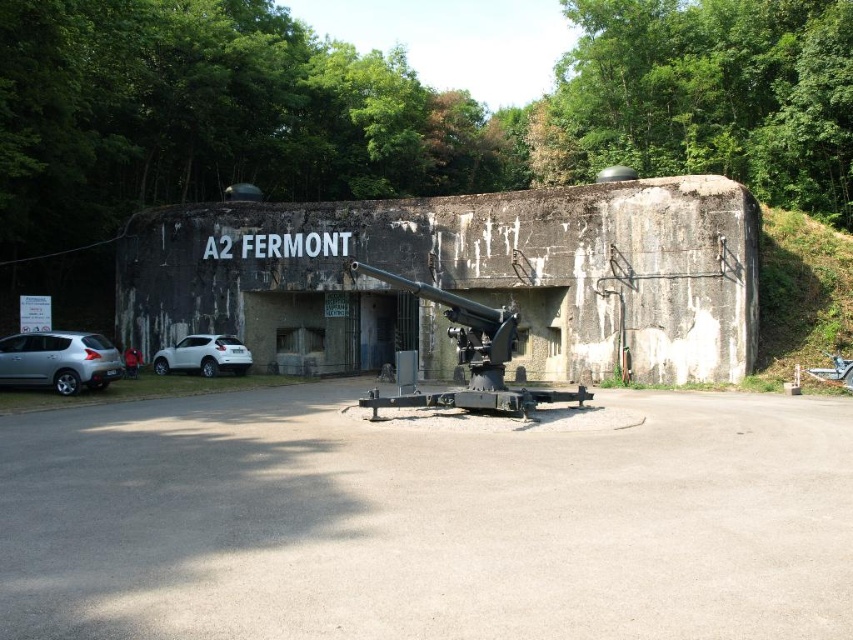
Between gray asphalt parking lot at center and satin silver car at lower left, which one is positioned lower?

gray asphalt parking lot at center is below.

Is the position of gray asphalt parking lot at center more distant than that of satin silver car at lower left?

That is False.

What do you see at coordinates (426, 522) in the screenshot?
I see `gray asphalt parking lot at center` at bounding box center [426, 522].

Locate an element on the screen. gray asphalt parking lot at center is located at coordinates (426, 522).

Does black matte cannon at center have a smaller size compared to white matte suv at lower left?

Incorrect, black matte cannon at center is not smaller in size than white matte suv at lower left.

Does black matte cannon at center have a lesser height compared to white matte suv at lower left?

No.

Who is more forward, [490,381] or [219,346]?

Point [490,381] is more forward.

Image resolution: width=853 pixels, height=640 pixels. What are the coordinates of `black matte cannon at center` in the screenshot? It's located at (469, 356).

Who is positioned more to the right, gray asphalt parking lot at center or black matte cannon at center?

black matte cannon at center is more to the right.

Between gray asphalt parking lot at center and black matte cannon at center, which one is positioned higher?

black matte cannon at center is higher up.

The width and height of the screenshot is (853, 640). What do you see at coordinates (426, 522) in the screenshot?
I see `gray asphalt parking lot at center` at bounding box center [426, 522].

Where is `gray asphalt parking lot at center`? Image resolution: width=853 pixels, height=640 pixels. gray asphalt parking lot at center is located at coordinates (426, 522).